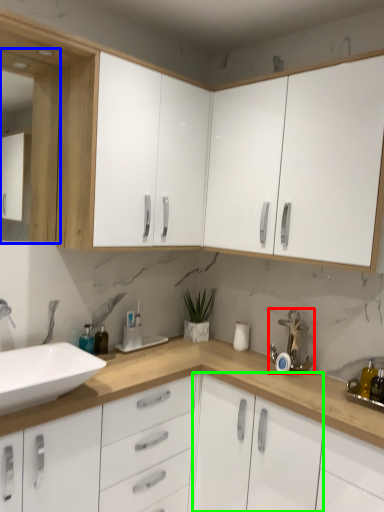
Question: Considering the real-world distances, which object is closest to faucet (highlighted by a red box)? medicine cabinet (highlighted by a blue box) or cabinetry (highlighted by a green box).

Choices:
 (A) medicine cabinet
 (B) cabinetry

Answer: (B)